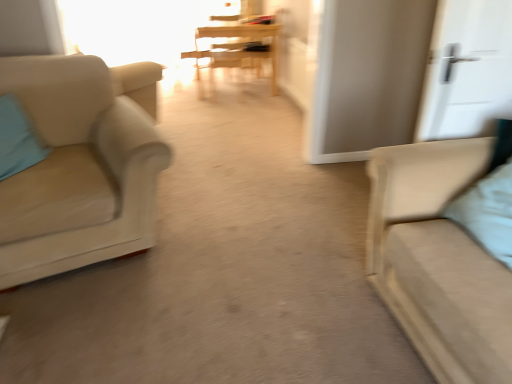
Question: From a real-world perspective, is transparent glass window at upper center physically below light blue fabric pillow at right, the 1th pillow from the front?

Choices:
 (A) yes
 (B) no

Answer: (A)

Question: Considering the relative sizes of transparent glass window at upper center and light blue fabric pillow at right, arranged as the second pillow when viewed from the back, in the image provided, is transparent glass window at upper center thinner than light blue fabric pillow at right, arranged as the second pillow when viewed from the back,?

Choices:
 (A) yes
 (B) no

Answer: (A)

Question: From the image's perspective, is transparent glass window at upper center below light blue fabric pillow at right, arranged as the second pillow when viewed from the back?

Choices:
 (A) no
 (B) yes

Answer: (A)

Question: Does transparent glass window at upper center come in front of light blue fabric pillow at right, the 1th pillow from the front?

Choices:
 (A) no
 (B) yes

Answer: (A)

Question: Is transparent glass window at upper center taller than light blue fabric pillow at right, arranged as the second pillow when viewed from the back?

Choices:
 (A) yes
 (B) no

Answer: (A)

Question: From the image's perspective, is transparent glass window at upper center above light blue fabric pillow at right, which is the 1th pillow in right-to-left order?

Choices:
 (A) yes
 (B) no

Answer: (A)

Question: Can you confirm if light blue fabric pillow at left, which appears as the first pillow when viewed from the left, is bigger than white matte door at upper right?

Choices:
 (A) no
 (B) yes

Answer: (A)

Question: Can you confirm if light blue fabric pillow at left, which ranks as the 1th pillow in back-to-front order, is wider than white matte door at upper right?

Choices:
 (A) yes
 (B) no

Answer: (A)

Question: Is light blue fabric pillow at left, which appears as the first pillow when viewed from the left, next to white matte door at upper right?

Choices:
 (A) no
 (B) yes

Answer: (A)

Question: Can you confirm if light blue fabric pillow at left, which appears as the first pillow when viewed from the left, is shorter than white matte door at upper right?

Choices:
 (A) yes
 (B) no

Answer: (A)

Question: Is light blue fabric pillow at left, which ranks as the 1th pillow in back-to-front order, looking in the opposite direction of white matte door at upper right?

Choices:
 (A) no
 (B) yes

Answer: (A)

Question: Could white matte door at upper right be considered to be inside light blue fabric pillow at left, which appears as the first pillow when viewed from the left?

Choices:
 (A) yes
 (B) no

Answer: (B)

Question: Is wooden table at center positioned in front of beige fabric chair at left?

Choices:
 (A) yes
 (B) no

Answer: (B)